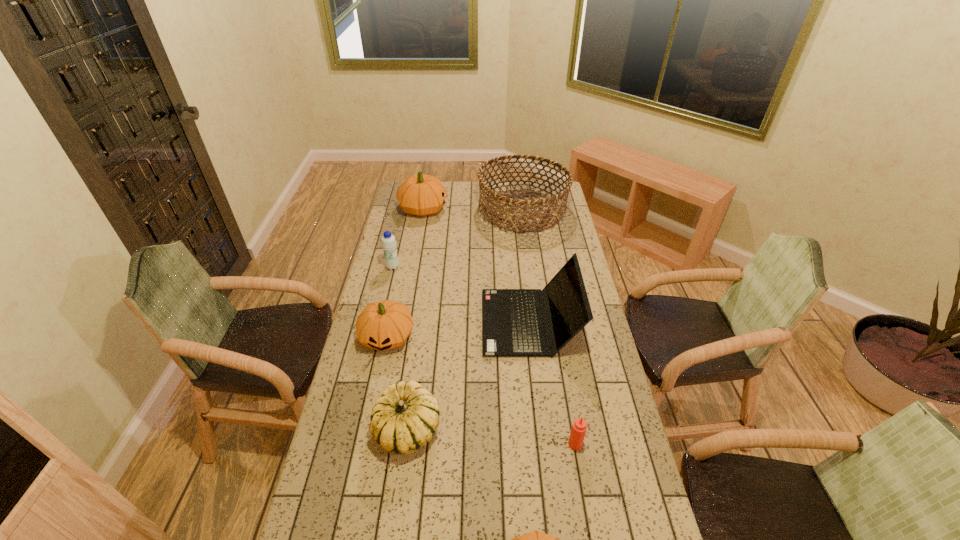
Image resolution: width=960 pixels, height=540 pixels. What are the coordinates of `basket located in the far edge section of the desktop` in the screenshot? It's located at (545, 216).

The image size is (960, 540). Find the location of `water bottle that is positioned at the left edge`. water bottle that is positioned at the left edge is located at coordinates (388, 242).

The width and height of the screenshot is (960, 540). I want to click on basket situated at the right edge, so click(545, 216).

Where is `laptop computer located in the right edge section of the desktop`? laptop computer located in the right edge section of the desktop is located at coordinates (512, 324).

The width and height of the screenshot is (960, 540). What are the coordinates of `Tabasco sauce that is at the right edge` in the screenshot? It's located at (579, 427).

Locate an element on the screen. The height and width of the screenshot is (540, 960). object situated at the far left corner is located at coordinates (421, 195).

Where is `object present at the far right corner`? The image size is (960, 540). object present at the far right corner is located at coordinates (545, 216).

The height and width of the screenshot is (540, 960). Identify the location of vacant space at the left edge of the desktop. (418, 228).

Find the location of `free space at the right edge of the desktop`. free space at the right edge of the desktop is located at coordinates (588, 335).

In the image, there is a desktop. At what (x,y) coordinates should I click in order to perform the action: click on free space at the far right corner. Please return your answer as a coordinate pair (x, y). Looking at the image, I should click on (553, 186).